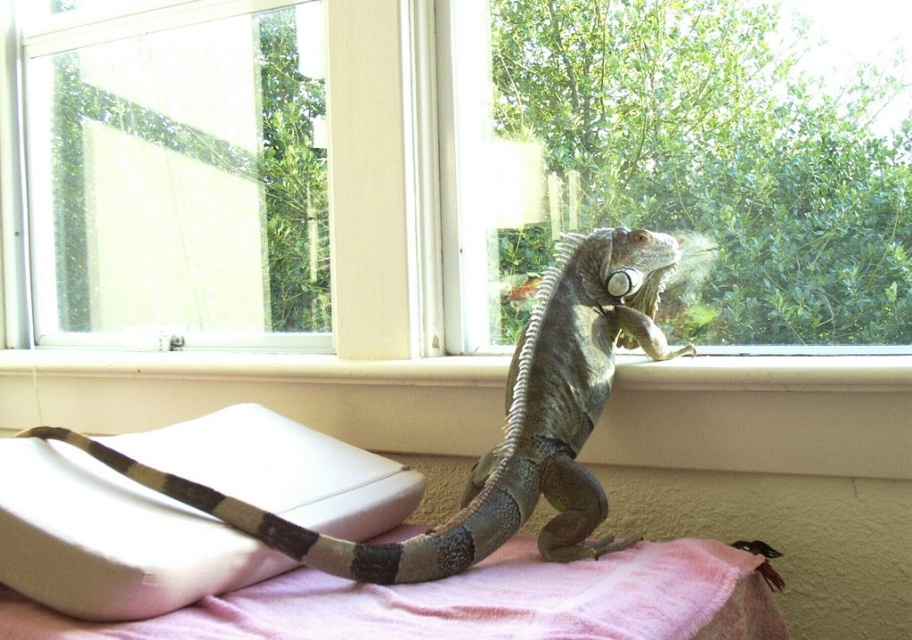
Is smooth white window sill at center bigger than green scaly lizard at upper center?

Indeed, smooth white window sill at center has a larger size compared to green scaly lizard at upper center.

Does point (463, 381) come behind point (504, 522)?

Yes, point (463, 381) is farther from viewer.

The image size is (912, 640). Find the location of `smooth white window sill at center`. smooth white window sill at center is located at coordinates [263, 394].

Can you confirm if white foam pillow at lower left is thinner than pink fabric bed at lower center?

Yes, white foam pillow at lower left is thinner than pink fabric bed at lower center.

Is white foam pillow at lower left below pink fabric bed at lower center?

No.

Is point (47, 560) in front of point (355, 595)?

That is True.

You are a GUI agent. You are given a task and a screenshot of the screen. Output one action in this format:
    pyautogui.click(x=<x>, y=<y>)
    Task: Click on the white foam pillow at lower left
    This screenshot has height=640, width=912.
    Given the screenshot: What is the action you would take?
    pyautogui.click(x=111, y=538)

Who is taller, green scaly lizard at upper center or pink fabric bed at lower center?

green scaly lizard at upper center

Is point (578, 493) closer to camera compared to point (532, 552)?

Yes, point (578, 493) is closer to viewer.

Identify the location of green scaly lizard at upper center. (504, 426).